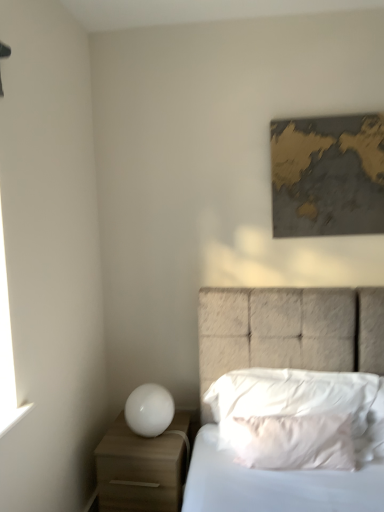
How much space does white soft pillow at center, placed as the first pillow when sorted from front to back, occupy horizontally?

It is 7.57 inches.

What are the coordinates of `white glossy sphere at lower left` in the screenshot? It's located at coord(149,410).

Image resolution: width=384 pixels, height=512 pixels. What do you see at coordinates (149, 410) in the screenshot? I see `white glossy sphere at lower left` at bounding box center [149, 410].

Where is `white soft pillow at center, the 2th pillow positioned from the back`? white soft pillow at center, the 2th pillow positioned from the back is located at coordinates (292, 441).

Could white soft pillow at center, the 1th pillow in the back-to-front sequence, be considered to be inside gold metallic map at upper right?

Actually, white soft pillow at center, the 1th pillow in the back-to-front sequence, is outside gold metallic map at upper right.

Does gold metallic map at upper right have a lesser width compared to white soft pillow at center, the 1th pillow in the back-to-front sequence?

Yes, gold metallic map at upper right is thinner than white soft pillow at center, the 1th pillow in the back-to-front sequence.

What's the angular difference between white soft pillow at center, the 2th pillow positioned from the back, and gold metallic map at upper right's facing directions?

The facing directions of white soft pillow at center, the 2th pillow positioned from the back, and gold metallic map at upper right are 7.55 degrees apart.

From a real-world perspective, relative to gold metallic map at upper right, is white soft pillow at center, the 2th pillow positioned from the back, vertically above or below?

white soft pillow at center, the 2th pillow positioned from the back, is situated lower than gold metallic map at upper right in the real world.

Who is more distant, white soft pillow at center, placed as the first pillow when sorted from front to back, or gold metallic map at upper right?

gold metallic map at upper right is further from the camera.

Can you confirm if white matte nightstand at lower left is positioned to the right of gold metallic map at upper right?

No.

Which of these two, white matte nightstand at lower left or gold metallic map at upper right, is smaller?

gold metallic map at upper right.

Is white matte nightstand at lower left surrounding gold metallic map at upper right?

No, white matte nightstand at lower left does not contain gold metallic map at upper right.

Find the location of a particular element. nightstand below the gold metallic map at upper right (from a real-world perspective) is located at coordinates (144, 466).

Is gold metallic map at upper right facing away from white matte nightstand at lower left?

No.

Relative to white matte nightstand at lower left, is gold metallic map at upper right in front or behind?

In the image, gold metallic map at upper right appears behind white matte nightstand at lower left.

Is point (376, 204) more distant than point (132, 436)?

Yes, point (376, 204) is farther from viewer.

From the picture: Is gold metallic map at upper right inside or outside of white matte nightstand at lower left?

gold metallic map at upper right lies outside white matte nightstand at lower left.

Which of these two, white glossy sphere at lower left or white soft pillow at center, placed as the 2th pillow when sorted from front to back, is smaller?

white glossy sphere at lower left.

From a real-world perspective, relative to white soft pillow at center, placed as the 2th pillow when sorted from front to back, is white glossy sphere at lower left vertically above or below?

white glossy sphere at lower left is below white soft pillow at center, placed as the 2th pillow when sorted from front to back.

From the image's perspective, between white glossy sphere at lower left and white soft pillow at center, the 1th pillow in the back-to-front sequence, which one is located above?

white soft pillow at center, the 1th pillow in the back-to-front sequence, is shown above in the image.

How many degrees apart are the facing directions of white glossy sphere at lower left and white soft pillow at center, the 1th pillow in the back-to-front sequence?

The angle between the facing direction of white glossy sphere at lower left and the facing direction of white soft pillow at center, the 1th pillow in the back-to-front sequence, is 2.2 degrees.

From the picture: Is textured fabric bed at center outside of gold metallic map at upper right?

Yes, textured fabric bed at center is not within gold metallic map at upper right.

Consider the image. Which is in front, textured fabric bed at center or gold metallic map at upper right?

textured fabric bed at center is closer to the camera.

This screenshot has width=384, height=512. What are the coordinates of `bed that is under the gold metallic map at upper right (from a real-world perspective)` in the screenshot? It's located at (290, 329).

From a real-world perspective, which is physically above, textured fabric bed at center or gold metallic map at upper right?

gold metallic map at upper right, from a real-world perspective.

Can you tell me how much white soft pillow at center, the 1th pillow in the back-to-front sequence, and white soft pillow at center, the 2th pillow positioned from the back, differ in facing direction?

The angle between the facing direction of white soft pillow at center, the 1th pillow in the back-to-front sequence, and the facing direction of white soft pillow at center, the 2th pillow positioned from the back, is 5.32 degrees.

This screenshot has width=384, height=512. Identify the location of pillow that is on the left side of white soft pillow at center, placed as the 2th pillow when sorted from front to back. (292, 441).

From a real-world perspective, is white soft pillow at center, the 1th pillow in the back-to-front sequence, below white soft pillow at center, the 2th pillow positioned from the back?

No, from a real-world perspective, white soft pillow at center, the 1th pillow in the back-to-front sequence, is not below white soft pillow at center, the 2th pillow positioned from the back.

The width and height of the screenshot is (384, 512). I want to click on picture frame behind the white soft pillow at center, placed as the 2th pillow when sorted from front to back, so point(328,175).

Image resolution: width=384 pixels, height=512 pixels. What are the coordinates of `the 2nd pillow below the gold metallic map at upper right (from the image's perspective)` in the screenshot? It's located at (292, 441).

From the image, which object appears to be farther from white soft pillow at center, placed as the 2th pillow when sorted from front to back, gold metallic map at upper right or white glossy sphere at lower left?

Among the two, gold metallic map at upper right is located further to white soft pillow at center, placed as the 2th pillow when sorted from front to back.

Consider the image. Which object lies further to the anchor point textured fabric bed at center, white matte nightstand at lower left or gold metallic map at upper right?

gold metallic map at upper right.

From the picture: Based on their spatial positions, is white soft pillow at center, the 1th pillow in the back-to-front sequence, or white soft pillow at center, the 2th pillow positioned from the back, closer to gold metallic map at upper right?

white soft pillow at center, the 1th pillow in the back-to-front sequence, lies closer to gold metallic map at upper right than the other object.

Which object lies nearer to the anchor point gold metallic map at upper right, textured fabric bed at center or white matte nightstand at lower left?

textured fabric bed at center is positioned closer to the anchor gold metallic map at upper right.

Which object lies nearer to the anchor point white glossy sphere at lower left, white matte nightstand at lower left or white soft pillow at center, the 2th pillow positioned from the back?

white matte nightstand at lower left.

Based on the photo, considering their positions, is white soft pillow at center, placed as the first pillow when sorted from front to back, positioned further to white soft pillow at center, the 1th pillow in the back-to-front sequence, than white glossy sphere at lower left?

Based on the image, white glossy sphere at lower left appears to be further to white soft pillow at center, the 1th pillow in the back-to-front sequence.

Which object lies nearer to the anchor point white matte nightstand at lower left, white soft pillow at center, placed as the 2th pillow when sorted from front to back, or textured fabric bed at center?

white soft pillow at center, placed as the 2th pillow when sorted from front to back, lies closer to white matte nightstand at lower left than the other object.

Estimate the real-world distances between objects in this image. Which object is closer to white matte nightstand at lower left, white glossy sphere at lower left or gold metallic map at upper right?

Among the two, white glossy sphere at lower left is located nearer to white matte nightstand at lower left.

Where is `nightstand between textured fabric bed at center and gold metallic map at upper right in the front-back direction`? nightstand between textured fabric bed at center and gold metallic map at upper right in the front-back direction is located at coordinates (144, 466).

At what (x,y) coordinates should I click in order to perform the action: click on table lamp between white matte nightstand at lower left and white soft pillow at center, the 2th pillow positioned from the back, in the horizontal direction. Please return your answer as a coordinate pair (x, y). The width and height of the screenshot is (384, 512). Looking at the image, I should click on pyautogui.click(x=149, y=410).

Locate an element on the screen. table lamp positioned between textured fabric bed at center and gold metallic map at upper right from near to far is located at coordinates (149, 410).

Find the location of a particular element. Image resolution: width=384 pixels, height=512 pixels. pillow between white glossy sphere at lower left and white soft pillow at center, the 1th pillow in the back-to-front sequence, in the horizontal direction is located at coordinates (292, 441).